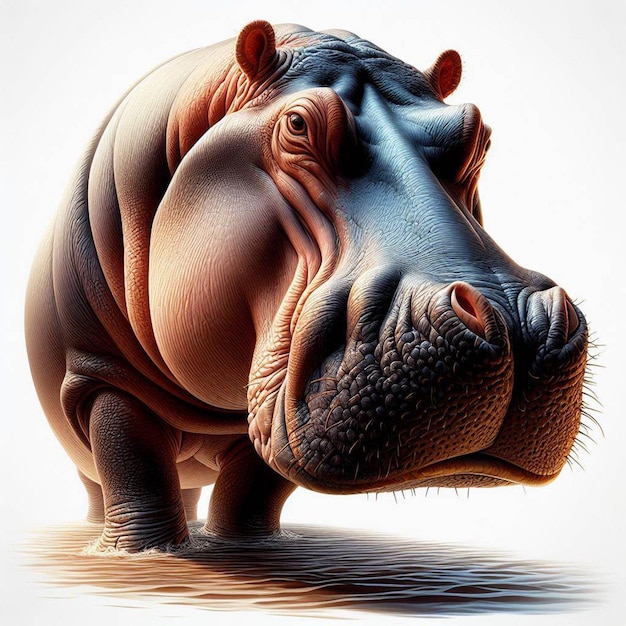
In order to click on bottom right leg in this screenshot , I will do `click(100, 500)`.